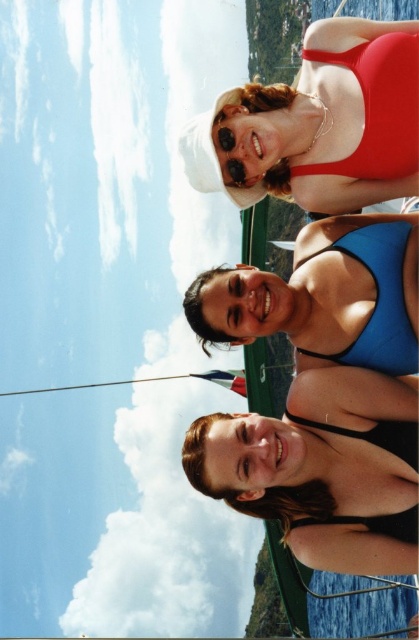
Where is `black matte swimsuit at lower center`? This screenshot has width=419, height=640. black matte swimsuit at lower center is located at coordinates (321, 467).

Measure the distance between point (379, 531) and camera.

The distance of point (379, 531) from camera is 56.85 meters.

At what (x,y) coordinates should I click in order to perform the action: click on black matte swimsuit at lower center. Please return your answer as a coordinate pair (x, y). Looking at the image, I should click on (321, 467).

Is matte red swimsuit at upper center taller than blue matte swimsuit at center?

Yes.

Is matte red swimsuit at upper center smaller than blue matte swimsuit at center?

No.

The height and width of the screenshot is (640, 419). What do you see at coordinates (318, 124) in the screenshot?
I see `matte red swimsuit at upper center` at bounding box center [318, 124].

The image size is (419, 640). What are the coordinates of `matte red swimsuit at upper center` in the screenshot? It's located at (318, 124).

From the picture: Between black matte swimsuit at lower center and blue matte swimsuit at center, which one appears on the left side from the viewer's perspective?

Positioned to the left is blue matte swimsuit at center.

What do you see at coordinates (321, 467) in the screenshot? I see `black matte swimsuit at lower center` at bounding box center [321, 467].

Where is `black matte swimsuit at lower center`? This screenshot has height=640, width=419. black matte swimsuit at lower center is located at coordinates (321, 467).